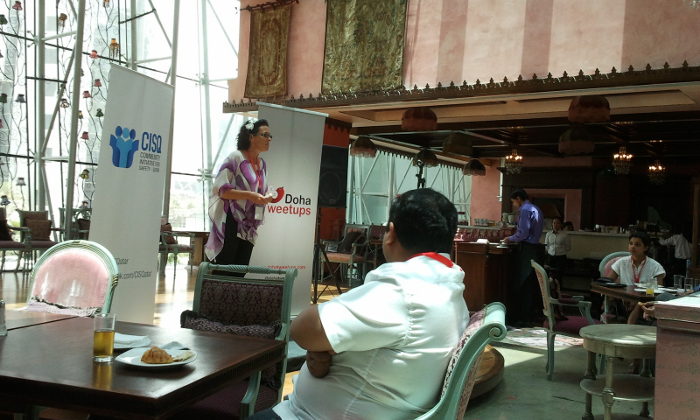
I want to click on floor, so click(533, 394).